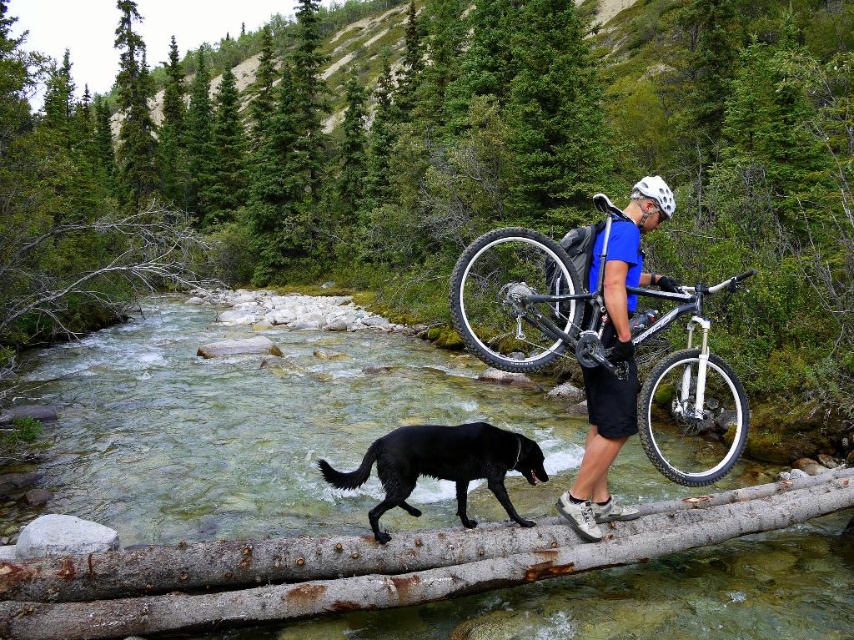
Is blue fabric shirt at center bigger than black matte dog at center?

No.

Is blue fabric shirt at center below black matte dog at center?

No.

Locate an element on the screen. blue fabric shirt at center is located at coordinates (x=615, y=362).

Measure the distance between clear water at log center and camera.

They are 17.78 feet apart.

Who is lower down, clear water at log center or white rubber tire at center?

clear water at log center

Find the location of `clear water at log center`. clear water at log center is located at coordinates (413, 492).

Is clear water at log center smaller than black rubber bicycle wheel at center?

Actually, clear water at log center might be larger than black rubber bicycle wheel at center.

Who is positioned more to the left, clear water at log center or black rubber bicycle wheel at center?

From the viewer's perspective, clear water at log center appears more on the left side.

Is point (648, 579) positioned in front of point (534, 316)?

No, (648, 579) is behind (534, 316).

The image size is (854, 640). Identify the location of clear water at log center. (413, 492).